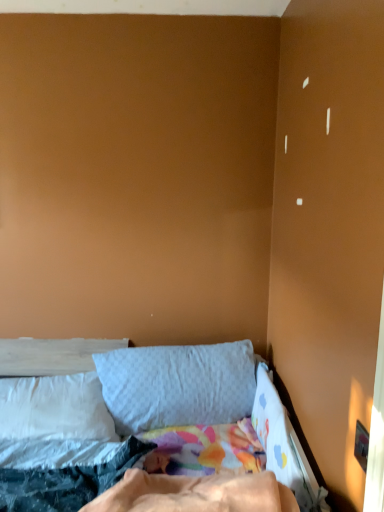
Image resolution: width=384 pixels, height=512 pixels. What do you see at coordinates (55, 408) in the screenshot? I see `white soft pillow at left, acting as the 1th pillow starting from the left` at bounding box center [55, 408].

Find the location of a particular element. gray fabric pillow at center, acting as the first pillow starting from the right is located at coordinates (177, 385).

This screenshot has width=384, height=512. I want to click on white soft pillow at left, the 2th pillow when ordered from right to left, so click(x=55, y=408).

Are soft cotton bed at lower left and white soft pillow at left, acting as the 1th pillow starting from the left, far apart?

Actually, soft cotton bed at lower left and white soft pillow at left, acting as the 1th pillow starting from the left, are a little close together.

Is soft cotton bed at lower left bigger or smaller than white soft pillow at left, acting as the 1th pillow starting from the left?

Clearly, soft cotton bed at lower left is larger in size than white soft pillow at left, acting as the 1th pillow starting from the left.

From their relative heights in the image, would you say soft cotton bed at lower left is taller or shorter than white soft pillow at left, the 2th pillow when ordered from right to left?

In the image, soft cotton bed at lower left appears to be taller than white soft pillow at left, the 2th pillow when ordered from right to left.

Considering the relative positions of white soft pillow at left, acting as the 1th pillow starting from the left, and soft cotton bed at lower left in the image provided, is white soft pillow at left, acting as the 1th pillow starting from the left, behind soft cotton bed at lower left?

Yes, it is behind soft cotton bed at lower left.

Can you tell me how much white soft pillow at left, acting as the 1th pillow starting from the left, and soft cotton bed at lower left differ in facing direction?

white soft pillow at left, acting as the 1th pillow starting from the left, and soft cotton bed at lower left are facing 3.79 degrees away from each other.

From the image's perspective, is white soft pillow at left, the 2th pillow when ordered from right to left, over soft cotton bed at lower left?

Indeed, from the image's perspective, white soft pillow at left, the 2th pillow when ordered from right to left, is shown above soft cotton bed at lower left.

Between point (10, 359) and point (239, 360), which one is positioned in front?

Point (239, 360)

Is soft cotton bed at lower left taller than gray fabric pillow at center, arranged as the second pillow when viewed from the left?

No, soft cotton bed at lower left is not taller than gray fabric pillow at center, arranged as the second pillow when viewed from the left.

From the image's perspective, is soft cotton bed at lower left over gray fabric pillow at center, acting as the first pillow starting from the right?

No.

Between soft cotton bed at lower left and gray fabric pillow at center, arranged as the second pillow when viewed from the left, which one is positioned behind?

gray fabric pillow at center, arranged as the second pillow when viewed from the left, is further away from the camera.

From the image's perspective, is white soft pillow at left, the 2th pillow when ordered from right to left, on top of gray fabric pillow at center, acting as the first pillow starting from the right?

No, from the image's perspective, white soft pillow at left, the 2th pillow when ordered from right to left, is not over gray fabric pillow at center, acting as the first pillow starting from the right.

Considering the relative sizes of white soft pillow at left, acting as the 1th pillow starting from the left, and gray fabric pillow at center, arranged as the second pillow when viewed from the left, in the image provided, is white soft pillow at left, acting as the 1th pillow starting from the left, smaller than gray fabric pillow at center, arranged as the second pillow when viewed from the left,?

Correct, white soft pillow at left, acting as the 1th pillow starting from the left, occupies less space than gray fabric pillow at center, arranged as the second pillow when viewed from the left.

Is the depth of white soft pillow at left, acting as the 1th pillow starting from the left, less than that of gray fabric pillow at center, arranged as the second pillow when viewed from the left?

Yes, the depth of white soft pillow at left, acting as the 1th pillow starting from the left, is less than that of gray fabric pillow at center, arranged as the second pillow when viewed from the left.

Considering the relative positions of gray fabric pillow at center, acting as the first pillow starting from the right, and white soft pillow at left, acting as the 1th pillow starting from the left, in the image provided, is gray fabric pillow at center, acting as the first pillow starting from the right, to the right of white soft pillow at left, acting as the 1th pillow starting from the left, from the viewer's perspective?

Indeed, gray fabric pillow at center, acting as the first pillow starting from the right, is positioned on the right side of white soft pillow at left, acting as the 1th pillow starting from the left.

From a real-world perspective, relative to white soft pillow at left, acting as the 1th pillow starting from the left, is gray fabric pillow at center, arranged as the second pillow when viewed from the left, vertically above or below?

gray fabric pillow at center, arranged as the second pillow when viewed from the left, is situated higher than white soft pillow at left, acting as the 1th pillow starting from the left, in the real world.

Does point (136, 428) come behind point (81, 438)?

Yes, point (136, 428) is behind point (81, 438).

Who is bigger, gray fabric pillow at center, acting as the first pillow starting from the right, or white soft pillow at left, the 2th pillow when ordered from right to left?

gray fabric pillow at center, acting as the first pillow starting from the right, is bigger.

Between gray fabric pillow at center, arranged as the second pillow when viewed from the left, and soft cotton bed at lower left, which one has more height?

gray fabric pillow at center, arranged as the second pillow when viewed from the left, is taller.

Is gray fabric pillow at center, acting as the first pillow starting from the right, to the right of soft cotton bed at lower left from the viewer's perspective?

Incorrect, gray fabric pillow at center, acting as the first pillow starting from the right, is not on the right side of soft cotton bed at lower left.

In the scene shown: From a real-world perspective, which object stands above the other?

In real-world perspective, soft cotton bed at lower left is above.

At what (x,y) coordinates should I click in order to perform the action: click on bed above the white soft pillow at left, acting as the 1th pillow starting from the left (from a real-world perspective). Please return your answer as a coordinate pair (x, y). The width and height of the screenshot is (384, 512). Looking at the image, I should click on (51, 355).

Where is `pillow that is the 1st object located above the soft cotton bed at lower left (from the image's perspective)`? pillow that is the 1st object located above the soft cotton bed at lower left (from the image's perspective) is located at coordinates (55, 408).

Based on their spatial positions, is soft cotton bed at lower left or white soft pillow at left, the 2th pillow when ordered from right to left, closer to gray fabric pillow at center, acting as the first pillow starting from the right?

white soft pillow at left, the 2th pillow when ordered from right to left, is positioned closer to the anchor gray fabric pillow at center, acting as the first pillow starting from the right.

When comparing their distances from soft cotton bed at lower left, does gray fabric pillow at center, arranged as the second pillow when viewed from the left, or white soft pillow at left, the 2th pillow when ordered from right to left, seem further?

gray fabric pillow at center, arranged as the second pillow when viewed from the left, lies further to soft cotton bed at lower left than the other object.

From the image, which object appears to be farther from soft cotton bed at lower left, white soft pillow at left, the 2th pillow when ordered from right to left, or gray fabric pillow at center, arranged as the second pillow when viewed from the left?

gray fabric pillow at center, arranged as the second pillow when viewed from the left.

Estimate the real-world distances between objects in this image. Which object is further from white soft pillow at left, acting as the 1th pillow starting from the left, soft cotton bed at lower left or gray fabric pillow at center, acting as the first pillow starting from the right?

The object further to white soft pillow at left, acting as the 1th pillow starting from the left, is gray fabric pillow at center, acting as the first pillow starting from the right.

Based on their spatial positions, is white soft pillow at left, the 2th pillow when ordered from right to left, or soft cotton bed at lower left further from gray fabric pillow at center, acting as the first pillow starting from the right?

Based on the image, soft cotton bed at lower left appears to be further to gray fabric pillow at center, acting as the first pillow starting from the right.

Estimate the real-world distances between objects in this image. Which object is further from white soft pillow at left, acting as the 1th pillow starting from the left, gray fabric pillow at center, arranged as the second pillow when viewed from the left, or soft cotton bed at lower left?

gray fabric pillow at center, arranged as the second pillow when viewed from the left, is further to white soft pillow at left, acting as the 1th pillow starting from the left.

Find the location of a particular element. The height and width of the screenshot is (512, 384). pillow between soft cotton bed at lower left and gray fabric pillow at center, arranged as the second pillow when viewed from the left, in the front-back direction is located at coordinates (55, 408).